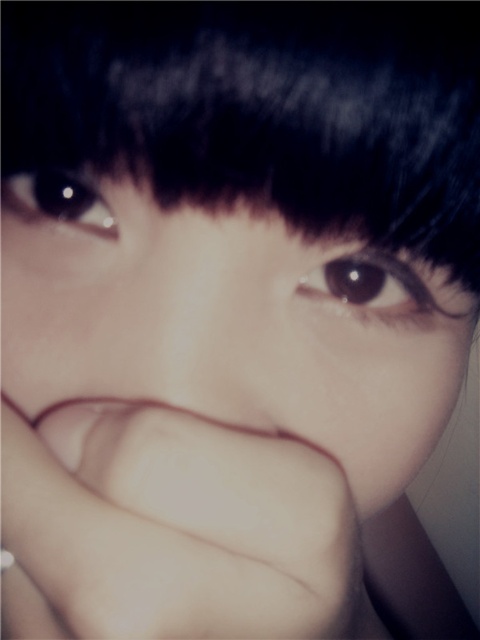
Based on the photo, can you confirm if smooth skin hand at center is positioned to the left of brown glossy eye at center?

Correct, you'll find smooth skin hand at center to the left of brown glossy eye at center.

Which is more to the right, smooth skin hand at center or brown glossy eye at center?

brown glossy eye at center

Who is more forward, [49,500] or [434,323]?

Positioned in front is point [49,500].

Locate an element on the screen. The height and width of the screenshot is (640, 480). smooth skin hand at center is located at coordinates (170, 528).

From the picture: Which of these two, smooth skin hand at center or brown glossy eye at upper left, stands shorter?

brown glossy eye at upper left is shorter.

Which is in front, point (166, 577) or point (68, 188)?

Point (166, 577)

This screenshot has width=480, height=640. In order to click on smooth skin hand at center in this screenshot , I will do `click(170, 528)`.

Is point (372, 157) closer to viewer compared to point (90, 216)?

That is True.

Is the position of black matte hair at upper center more distant than that of brown glossy eye at upper left?

No, black matte hair at upper center is closer to the viewer.

Is point (377, 205) more distant than point (67, 209)?

No, (377, 205) is in front of (67, 209).

Locate an element on the screen. black matte hair at upper center is located at coordinates (263, 109).